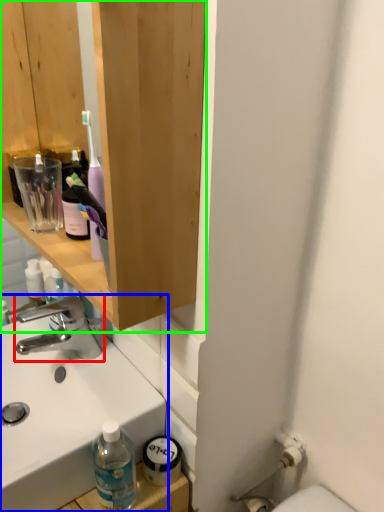
Question: Considering the real-world distances, which object is farthest from tap (highlighted by a red box)? sink (highlighted by a blue box) or bathroom cabinet (highlighted by a green box)?

Choices:
 (A) sink
 (B) bathroom cabinet

Answer: (B)